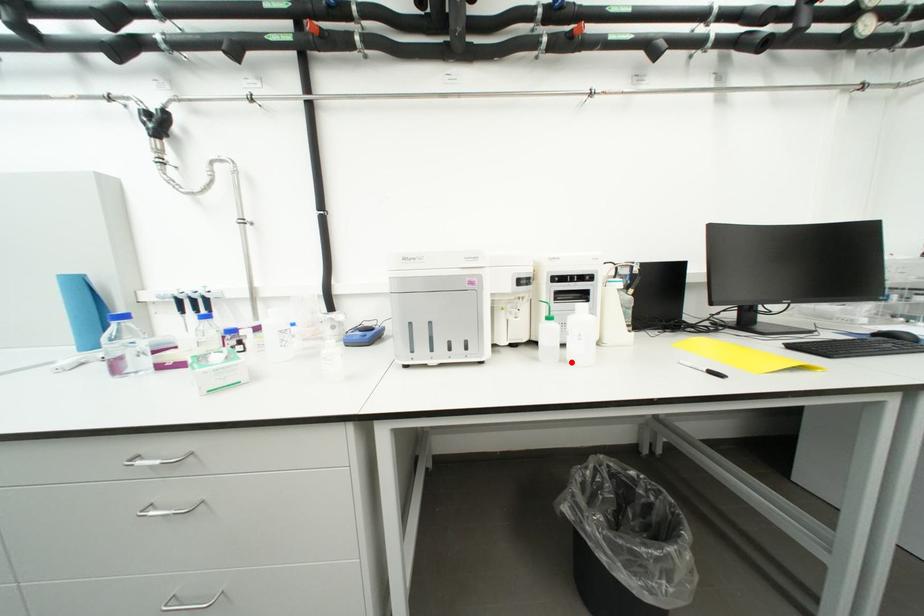
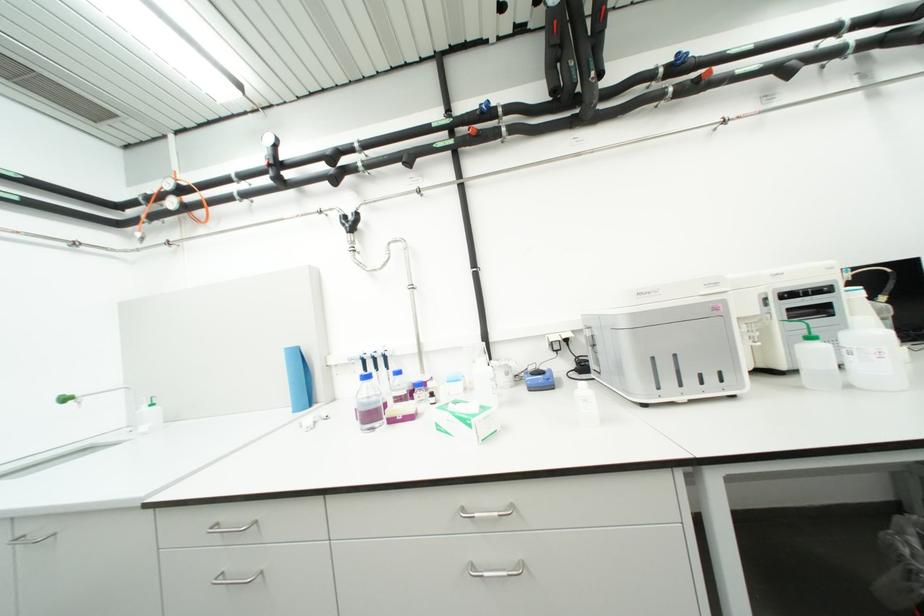
The point at the highlighted location is marked in the first image. Where is the corresponding point in the second image?

(857, 387)